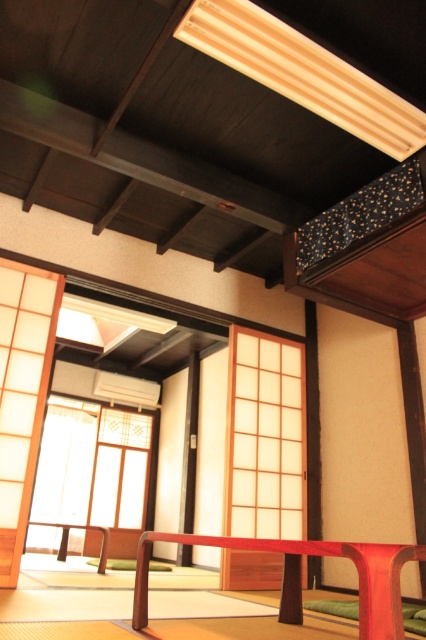
Is point (37, 540) less distant than point (308, 552)?

No, (37, 540) is further to viewer.

I want to click on translucent paper window at center, so click(x=94, y=468).

At what (x,y) coordinates should I click in order to perform the action: click on translucent paper window at center. Please return your answer as a coordinate pair (x, y). Looking at the image, I should click on (94, 468).

Between translucent wood window at center and translucent paper window at center, which one is positioned lower?

Positioned lower is translucent paper window at center.

Which is behind, point (247, 557) or point (123, 488)?

The point (123, 488) is more distant.

Find the location of a particular element. This screenshot has height=640, width=426. translucent wood window at center is located at coordinates coord(264,436).

Which is more to the right, translucent wood window at center or matte red table at center?

translucent wood window at center

Is point (250, 525) closer to camera compared to point (291, 612)?

No, (250, 525) is further to viewer.

What do you see at coordinates (264, 436) in the screenshot?
I see `translucent wood window at center` at bounding box center [264, 436].

Where is `translucent wood window at center`? translucent wood window at center is located at coordinates (264, 436).